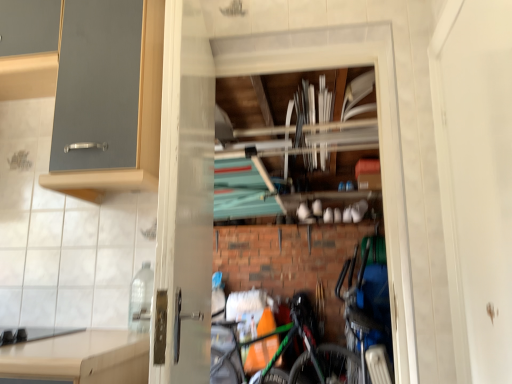
Question: From the image's perspective, is matte gray cabinet at upper left located beneath black matte gas stove at lower left?

Choices:
 (A) no
 (B) yes

Answer: (A)

Question: From a real-world perspective, does matte gray cabinet at upper left sit lower than black matte gas stove at lower left?

Choices:
 (A) no
 (B) yes

Answer: (A)

Question: Is matte gray cabinet at upper left facing towards black matte gas stove at lower left?

Choices:
 (A) yes
 (B) no

Answer: (B)

Question: Considering the relative positions of matte gray cabinet at upper left and black matte gas stove at lower left in the image provided, is matte gray cabinet at upper left to the right of black matte gas stove at lower left from the viewer's perspective?

Choices:
 (A) yes
 (B) no

Answer: (A)

Question: Considering the relative positions of matte gray cabinet at upper left and black matte gas stove at lower left in the image provided, is matte gray cabinet at upper left to the left of black matte gas stove at lower left from the viewer's perspective?

Choices:
 (A) no
 (B) yes

Answer: (A)

Question: Is black matte gas stove at lower left located within matte gray cabinet at upper left?

Choices:
 (A) no
 (B) yes

Answer: (A)

Question: Does matte gray cabinet at upper left lie in front of blue metallic bicycle at lower right, the second bicycle in the front-to-back sequence?

Choices:
 (A) yes
 (B) no

Answer: (A)

Question: Is matte gray cabinet at upper left far away from blue metallic bicycle at lower right, positioned as the second bicycle in left-to-right order?

Choices:
 (A) yes
 (B) no

Answer: (A)

Question: Is matte gray cabinet at upper left shorter than blue metallic bicycle at lower right, positioned as the second bicycle in left-to-right order?

Choices:
 (A) no
 (B) yes

Answer: (B)

Question: Is matte gray cabinet at upper left not inside blue metallic bicycle at lower right, placed as the 1th bicycle when sorted from right to left?

Choices:
 (A) no
 (B) yes

Answer: (B)

Question: Is matte gray cabinet at upper left further to the viewer compared to blue metallic bicycle at lower right, placed as the 1th bicycle when sorted from right to left?

Choices:
 (A) no
 (B) yes

Answer: (A)

Question: Is the surface of matte gray cabinet at upper left in direct contact with blue metallic bicycle at lower right, the 1th bicycle in the back-to-front sequence?

Choices:
 (A) no
 (B) yes

Answer: (A)

Question: From the image's perspective, is blue metallic bicycle at lower right, positioned as the second bicycle in left-to-right order, under green matte bicycle at center, which is the first bicycle from left to right?

Choices:
 (A) no
 (B) yes

Answer: (B)